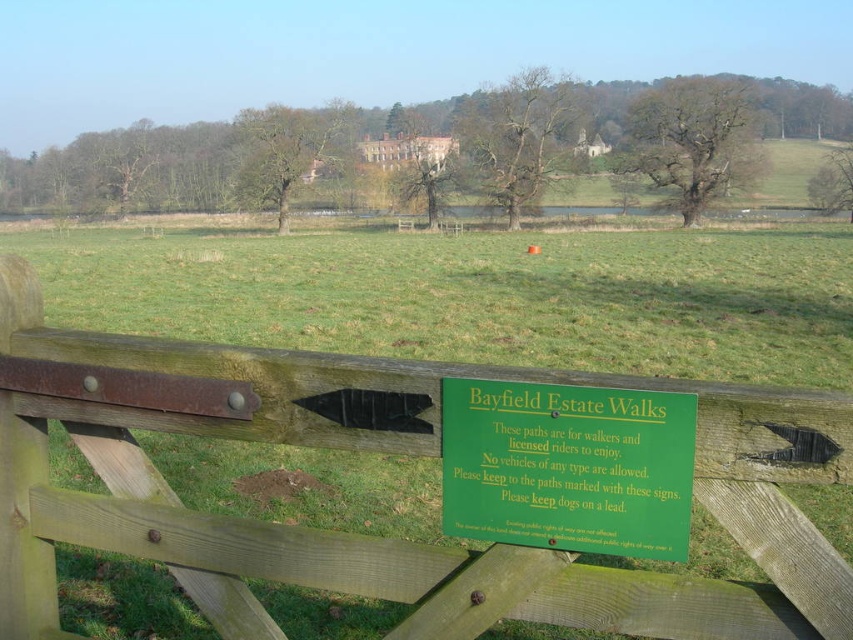
You are a hiker who wants to take a shortcut through the field. You see the green wooden fence at center and the green plastic sign at center. Which object is closer to you?

The green wooden fence at center is closer to you as it is in front of the green plastic sign at center.

You are a hiker planning to walk through the Bayfield Estate Walks. You see the green wooden fence at center and the green plastic sign at center. Which object is taller?

The green wooden fence at center is taller than the green plastic sign at center.

You are standing at the fence with the green sign and want to walk towards the two points marked in the field. Which point will you reach first, point (195, 588) or point (534, 520)?

Point (195, 588) is further to the camera than point (534, 520), so you will reach point (534, 520) first because it is closer to you.